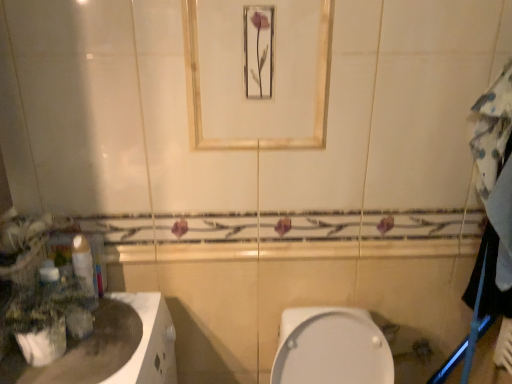
Locate an element on the screen. The height and width of the screenshot is (384, 512). blank space situated above green matte plant at left (from a real-world perspective) is located at coordinates (53, 301).